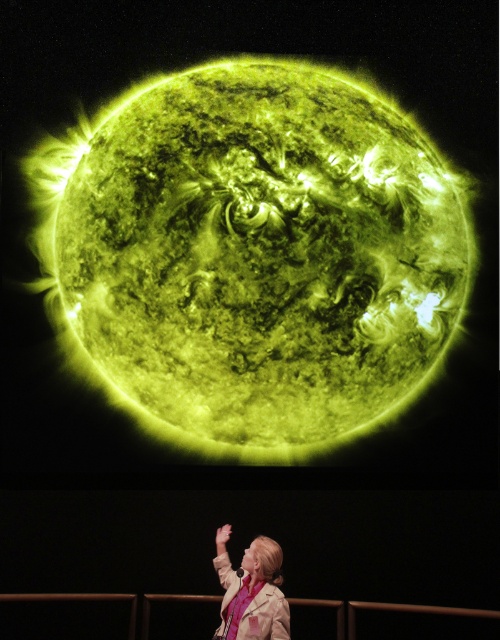
Question: Which point is closer to the camera?

Choices:
 (A) beige fabric jacket at lower center
 (B) yellow/glowing plasma sun at upper center
 (C) smooth skin hand at lower center

Answer: (A)

Question: Which point is closer to the camera?

Choices:
 (A) pyautogui.click(x=238, y=598)
 (B) pyautogui.click(x=58, y=160)
 (C) pyautogui.click(x=219, y=536)

Answer: (A)

Question: From the image, what is the correct spatial relationship of yellow/glowing plasma sun at upper center in relation to beige fabric jacket at lower center?

Choices:
 (A) left
 (B) right

Answer: (A)

Question: Can you confirm if yellow/glowing plasma sun at upper center is wider than smooth skin hand at lower center?

Choices:
 (A) yes
 (B) no

Answer: (A)

Question: Which object appears farthest from the camera in this image?

Choices:
 (A) yellow/glowing plasma sun at upper center
 (B) smooth skin hand at lower center
 (C) beige fabric jacket at lower center

Answer: (A)

Question: Is yellow/glowing plasma sun at upper center further to camera compared to beige fabric jacket at lower center?

Choices:
 (A) yes
 (B) no

Answer: (A)